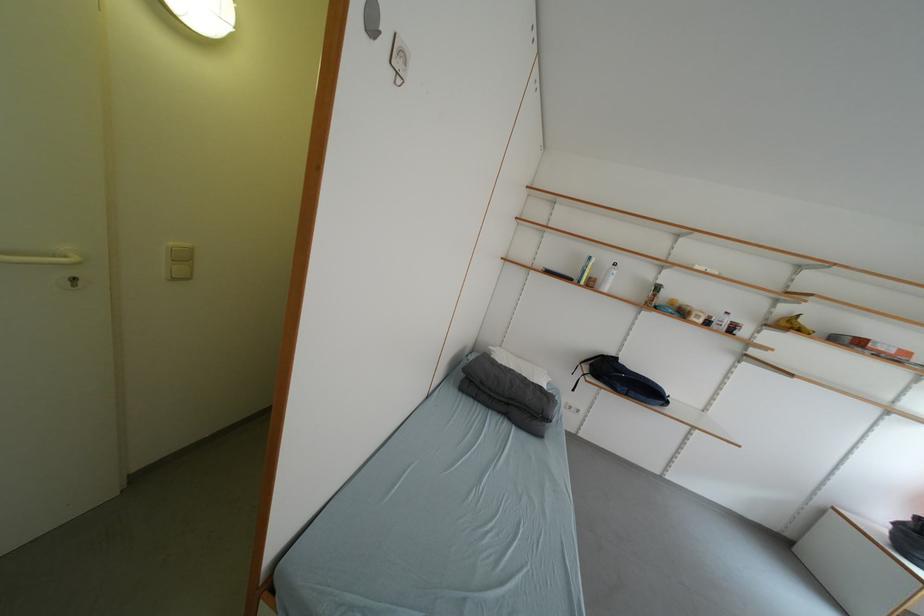
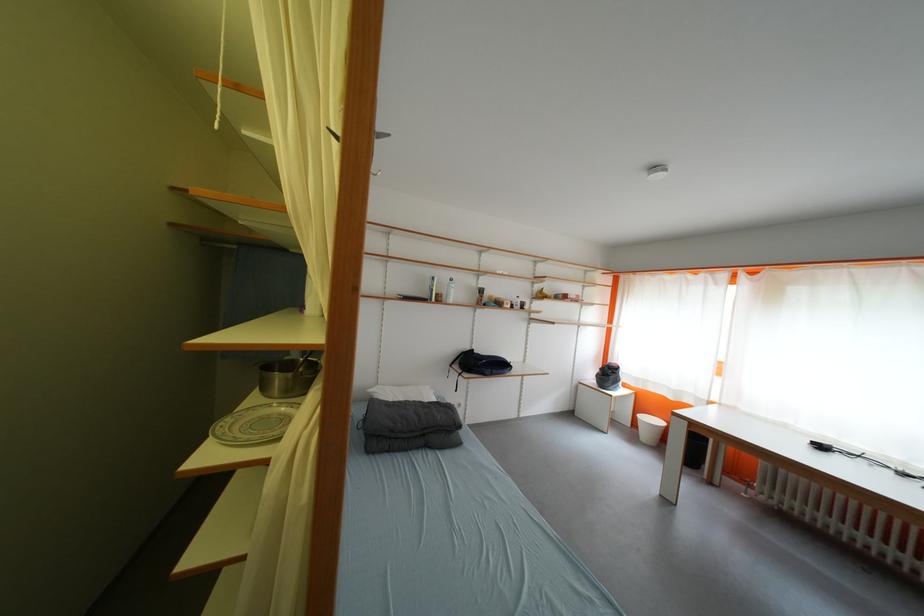
In the second image, find the point that corresponds to (x=550, y=272) in the first image.

(405, 299)